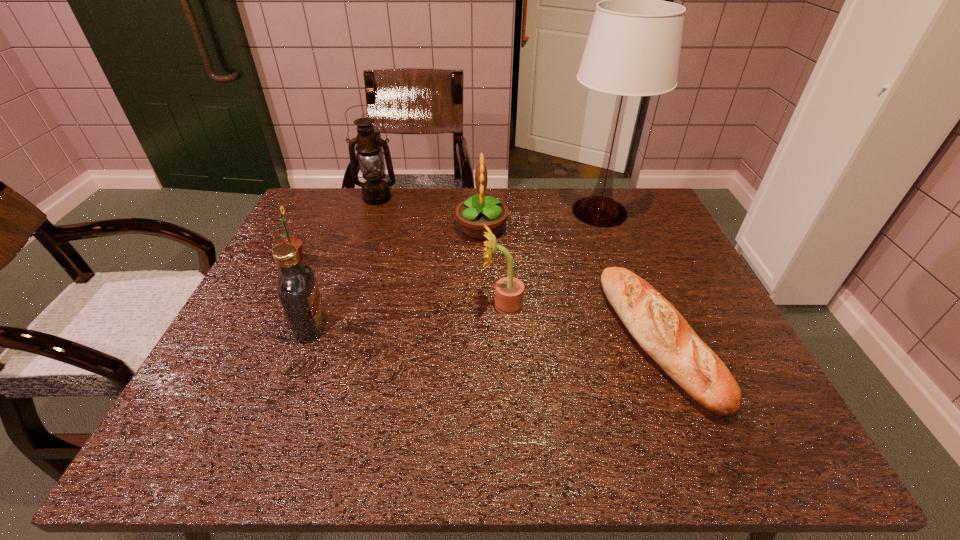
Where is `the tallest object`? This screenshot has height=540, width=960. the tallest object is located at coordinates (633, 49).

Find the location of a particular element. The height and width of the screenshot is (540, 960). the sixth shortest object is located at coordinates (375, 191).

Where is `the farthest sunflower`? This screenshot has height=540, width=960. the farthest sunflower is located at coordinates (471, 214).

Locate an element on the screen. the nearest sunflower is located at coordinates (509, 291).

This screenshot has height=540, width=960. What are the coordinates of `vodka` in the screenshot? It's located at (298, 292).

Where is `the leftmost object`? This screenshot has height=540, width=960. the leftmost object is located at coordinates (296, 242).

Image resolution: width=960 pixels, height=540 pixels. What are the coordinates of `the second nearest sunflower` in the screenshot? It's located at (296, 242).

Find the location of a particular element. The width and height of the screenshot is (960, 540). baguet is located at coordinates (662, 332).

I want to click on free space located 0.380m above the cylindrical shade of the tallest object, so click(645, 335).

Locate an element on the screen. This screenshot has height=540, width=960. free space located on the front of the oil lamp is located at coordinates (370, 220).